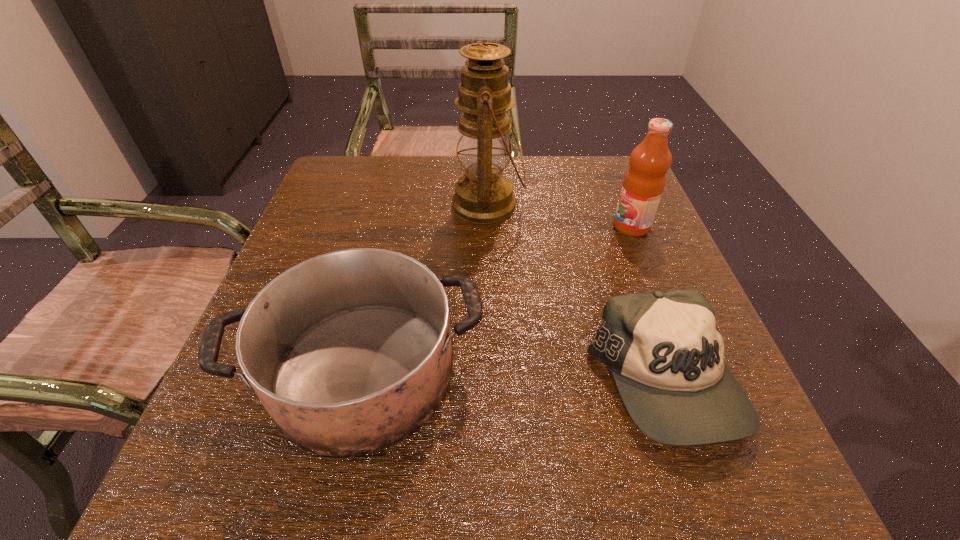
This screenshot has width=960, height=540. I want to click on blank space at the right edge of the desktop, so click(x=623, y=235).

Locate an element on the screen. This screenshot has width=960, height=540. vacant area at the near left corner is located at coordinates (272, 447).

This screenshot has width=960, height=540. Identify the location of free spot at the far right corner of the desktop. (589, 198).

In the image, there is a desktop. Identify the location of vacant space at the near right corner. The image size is (960, 540). click(x=772, y=468).

This screenshot has height=540, width=960. What are the coordinates of `free space that is in between the fruit juice and the third tallest object` in the screenshot? It's located at (497, 299).

Where is `vacant space that is in between the third shortest object and the second shortest object`? The width and height of the screenshot is (960, 540). vacant space that is in between the third shortest object and the second shortest object is located at coordinates (497, 299).

Where is `vacant point located between the third shortest object and the saucepan`? The width and height of the screenshot is (960, 540). vacant point located between the third shortest object and the saucepan is located at coordinates click(497, 299).

What are the coordinates of `free spot between the third shortest object and the saucepan` in the screenshot? It's located at (497, 299).

Locate an element on the screen. The width and height of the screenshot is (960, 540). free space between the fruit juice and the tallest object is located at coordinates (560, 215).

Find the location of `free space between the fruit juice and the saucepan`. free space between the fruit juice and the saucepan is located at coordinates (497, 299).